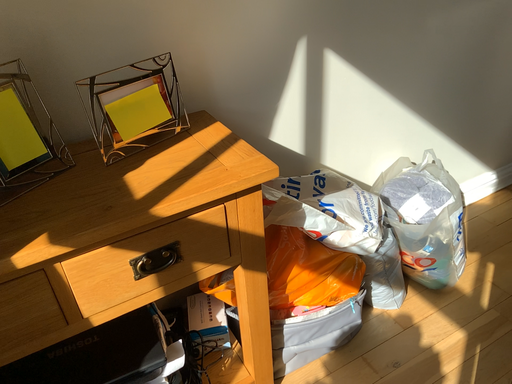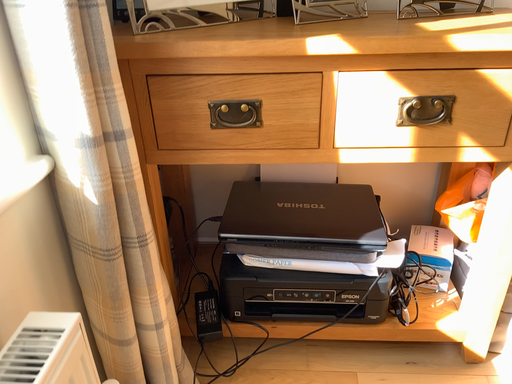
Question: How did the camera likely rotate when shooting the video?

Choices:
 (A) rotated right
 (B) rotated left

Answer: (B)